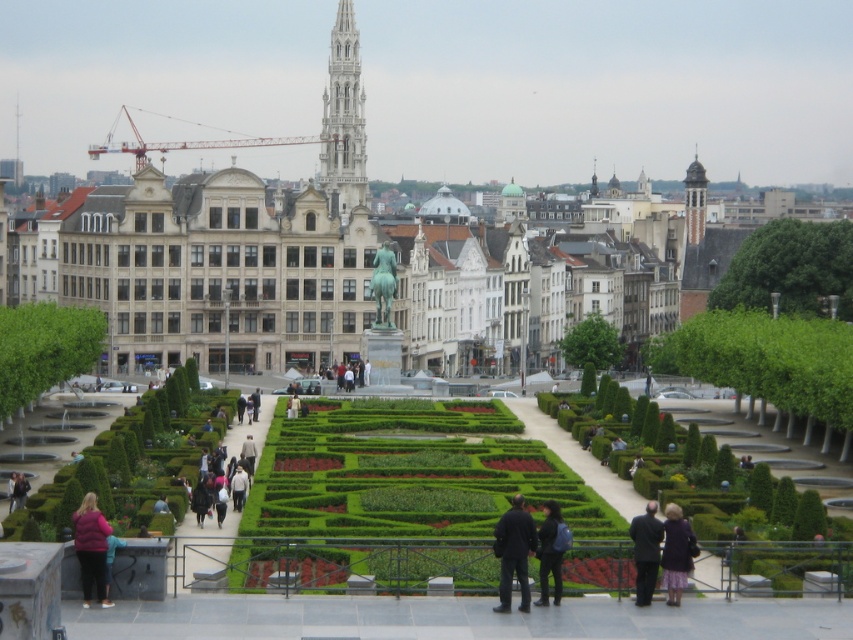
You are standing in the garden and want to pick up both the dark blue fabric coat at lower center and the dark blue jeans at center. Which item should you pick up first to follow the shortest path?

You should pick up the dark blue fabric coat at lower center first because it is closer to you than the dark blue jeans at center, so the shortest path would be to retrieve it first.

You are standing at the center of the garden and want to place a decorative pot exactly halfway between the dark blue fabric coat at lower center and the statue of a figure on horseback. Which direction should you move from the coat to reach the halfway point?

To place the decorative pot halfway between the dark blue fabric coat at lower center and the statue of a figure on horseback, you should move towards the statue from the coat, as the statue is centrally positioned and the coat is located at coordinates closer to the lower center. The halfway point would be along the line connecting their positions.

You are standing in the garden and want to walk from the point at coordinates point (x=111, y=422) to the point at coordinates point (x=100, y=547). Which direction should you move to get closer to your destination?

You should move away from the viewer because point (x=111, y=422) is closer to you than point (x=100, y=547). Moving away from the viewer will take you towards the farther point.